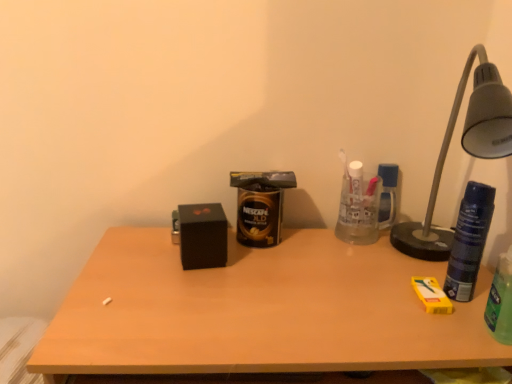
I want to click on unoccupied region to the right of gold metallic can at center, the 1th beverage in the left-to-right sequence, so click(x=333, y=251).